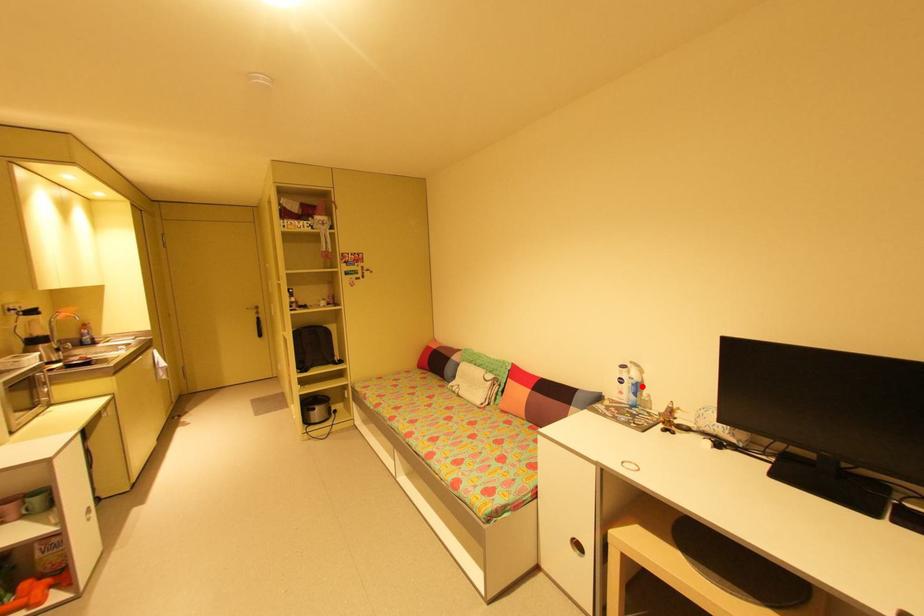
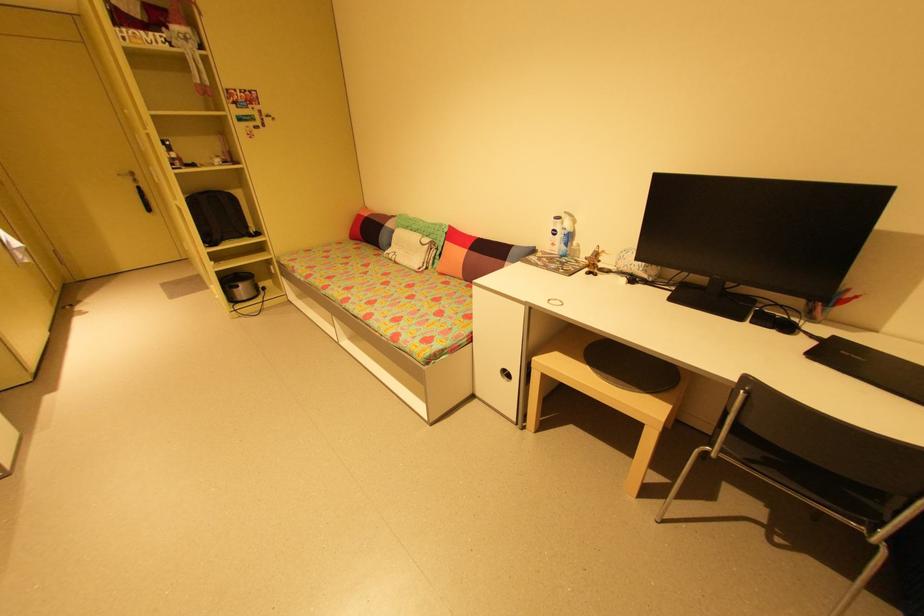
Question: I am providing you with two images of the same scene from different viewpoints. Image1 has a red point marked. In image2, the corresponding 3D location appears at what relative position? Reply with the corresponding letter.

Choices:
 (A) Closer
 (B) Farther

Answer: (A)